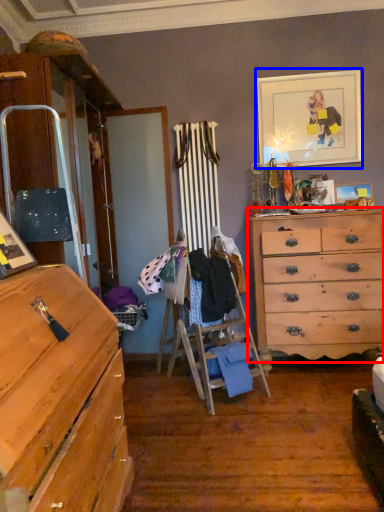
Question: Which object is closer to the camera taking this photo, chest of drawers (highlighted by a red box) or picture frame (highlighted by a blue box)?

Choices:
 (A) chest of drawers
 (B) picture frame

Answer: (A)